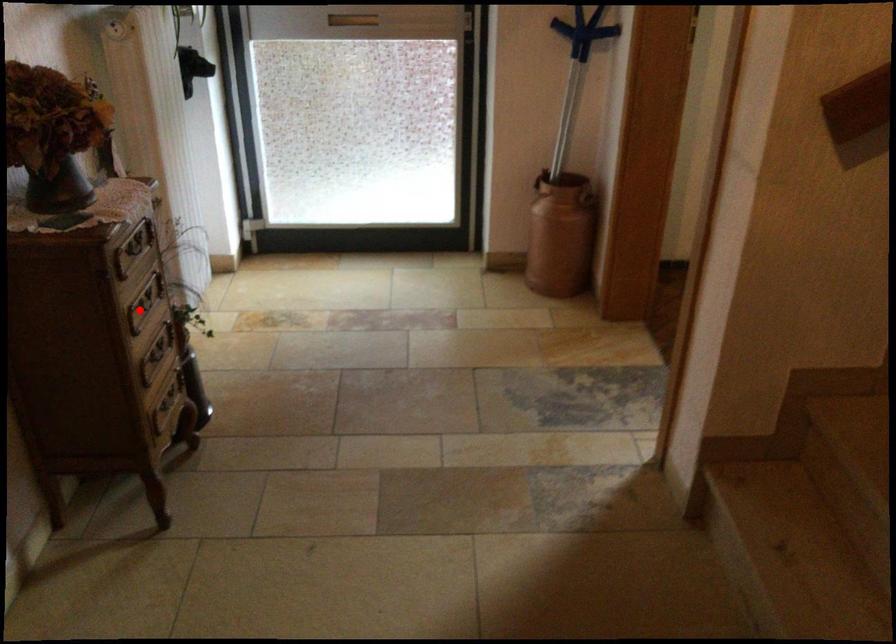
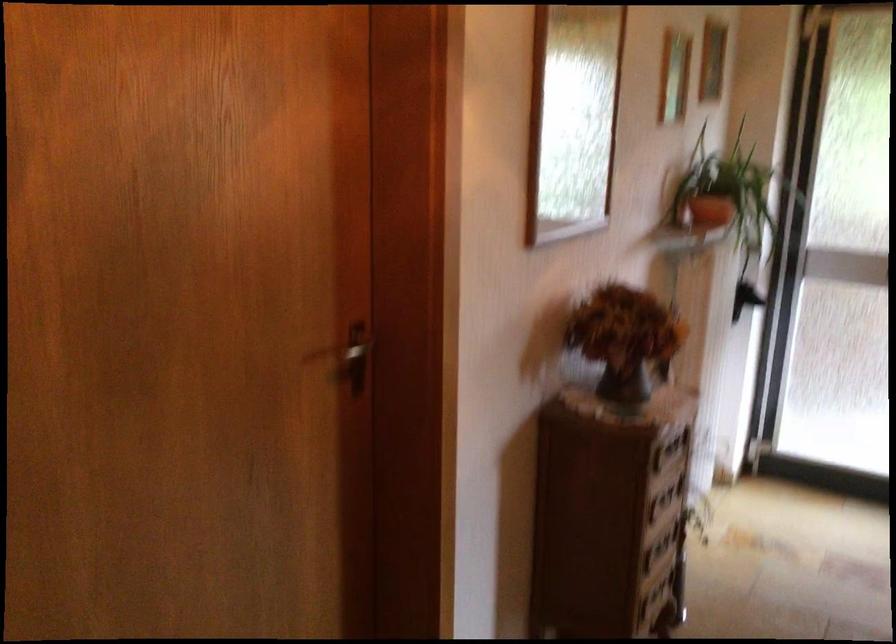
Where in the second image is the point corresponding to the highlighted location from the first image?

(659, 504)